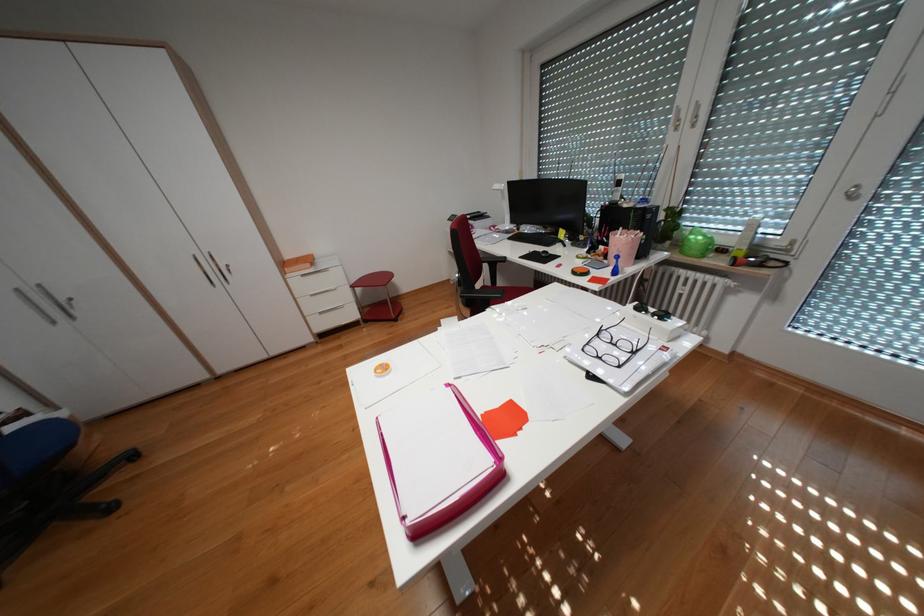
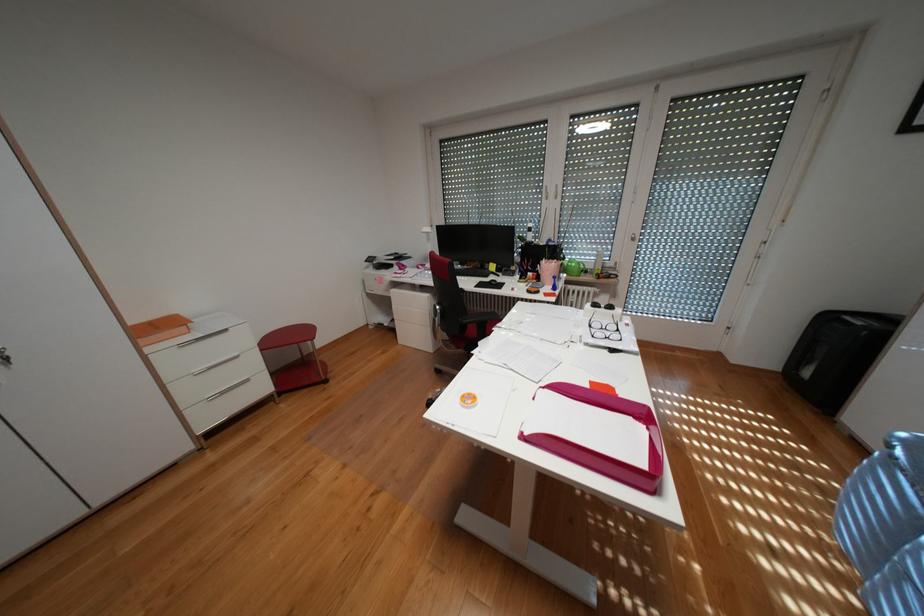
The point at (322, 260) is marked in the first image. Where is the corresponding point in the second image?

(184, 323)